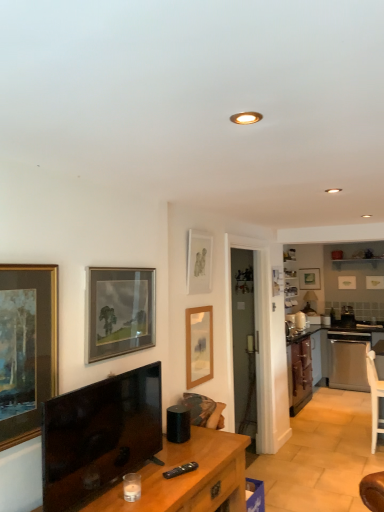
I want to click on free space above wooden desk at center (from a real-world perspective), so click(x=155, y=465).